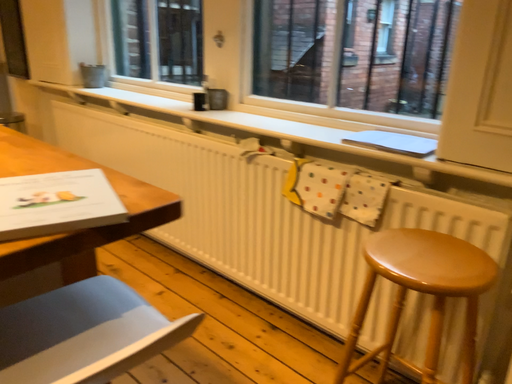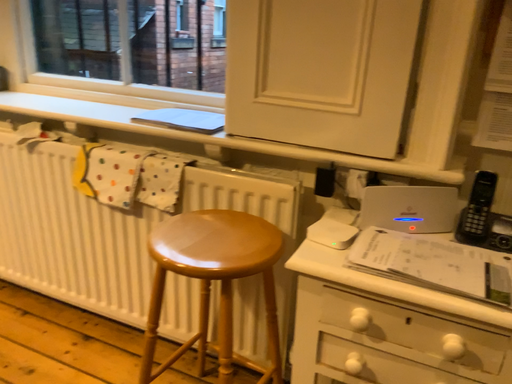
Question: How did the camera likely rotate when shooting the video?

Choices:
 (A) rotated right
 (B) rotated left

Answer: (A)